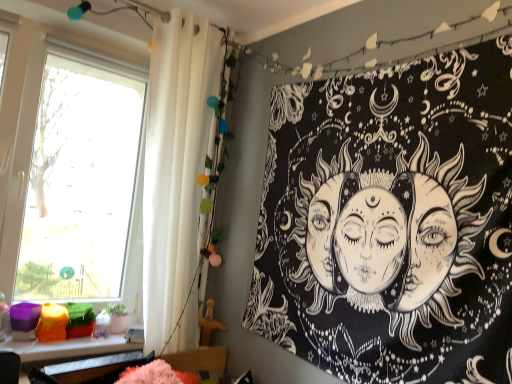
Where is `free point above transparent glass window at left (from a real-world perspective)`? This screenshot has height=384, width=512. free point above transparent glass window at left (from a real-world perspective) is located at coordinates (82, 23).